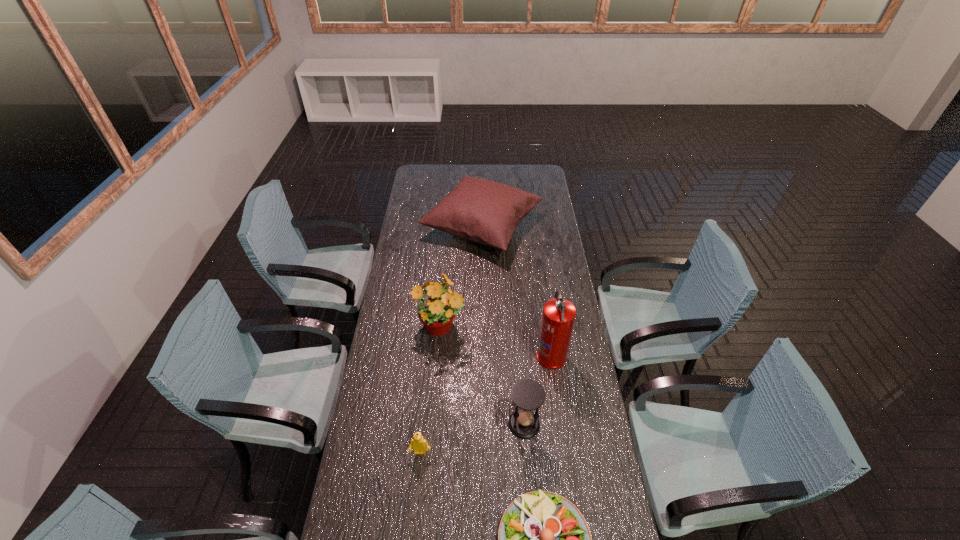
Find the location of `vacant space located 0.220m on the back of the cushion`. vacant space located 0.220m on the back of the cushion is located at coordinates (482, 173).

The height and width of the screenshot is (540, 960). I want to click on blank area located 0.080m on the back of the hourglass, so click(521, 391).

In order to click on vacant space situated on the face of the second shortest object in this screenshot , I will do `click(418, 476)`.

Find the location of a particular element. This screenshot has width=960, height=540. flowerpot located at the left edge is located at coordinates (436, 312).

The image size is (960, 540). In order to click on cushion that is at the left edge in this screenshot , I will do `click(483, 211)`.

This screenshot has height=540, width=960. What are the coordinates of `fire extinguisher that is at the right edge` in the screenshot? It's located at (558, 318).

Image resolution: width=960 pixels, height=540 pixels. I want to click on cushion that is at the right edge, so click(x=483, y=211).

Identify the location of vacant space at the left edge of the desktop. (383, 351).

In the image, there is a desktop. Identify the location of vacant space at the right edge. (554, 211).

At what (x,y) coordinates should I click in order to perform the action: click on vacant area at the far left corner of the desktop. Please return your answer as a coordinate pair (x, y). The width and height of the screenshot is (960, 540). Looking at the image, I should click on (430, 173).